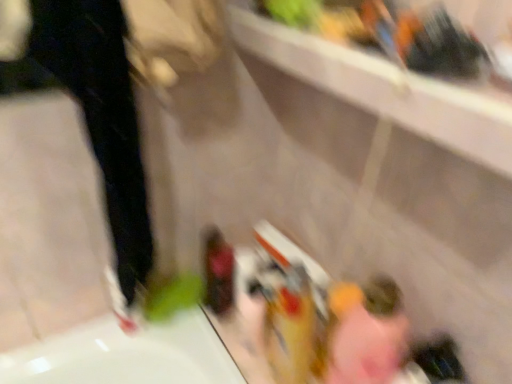
Question: From the image's perspective, is black matte pants at left above or below white matte shoe at lower left?

Choices:
 (A) below
 (B) above

Answer: (B)

Question: In terms of width, does black matte pants at left look wider or thinner when compared to white matte shoe at lower left?

Choices:
 (A) thin
 (B) wide

Answer: (B)

Question: Estimate the real-world distances between objects in this image. Which object is closer to the white matte shoe at lower left?

Choices:
 (A) black matte pants at left
 (B) pink fabric at lower right

Answer: (A)

Question: Which object is positioned farthest from the white matte shoe at lower left?

Choices:
 (A) black matte pants at left
 (B) pink fabric at lower right

Answer: (B)